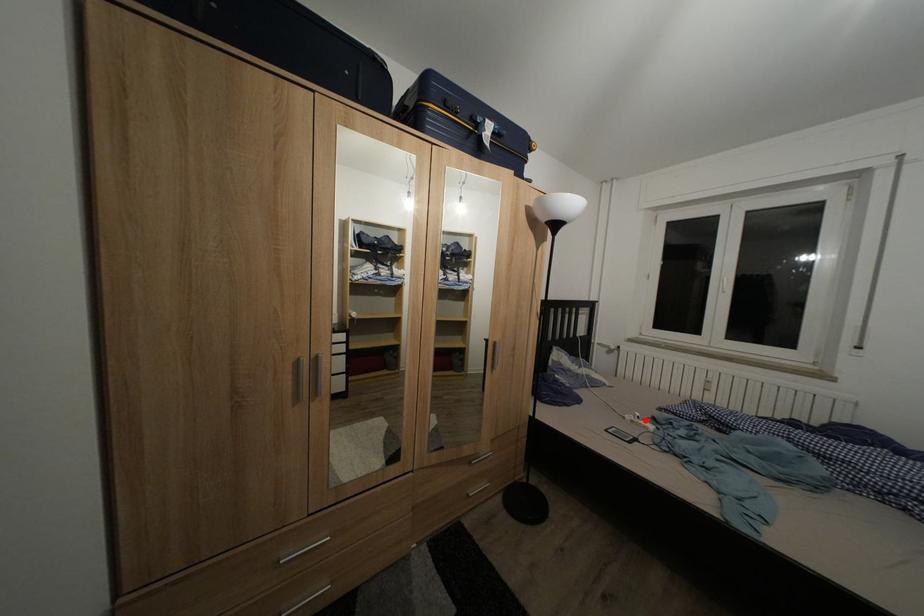
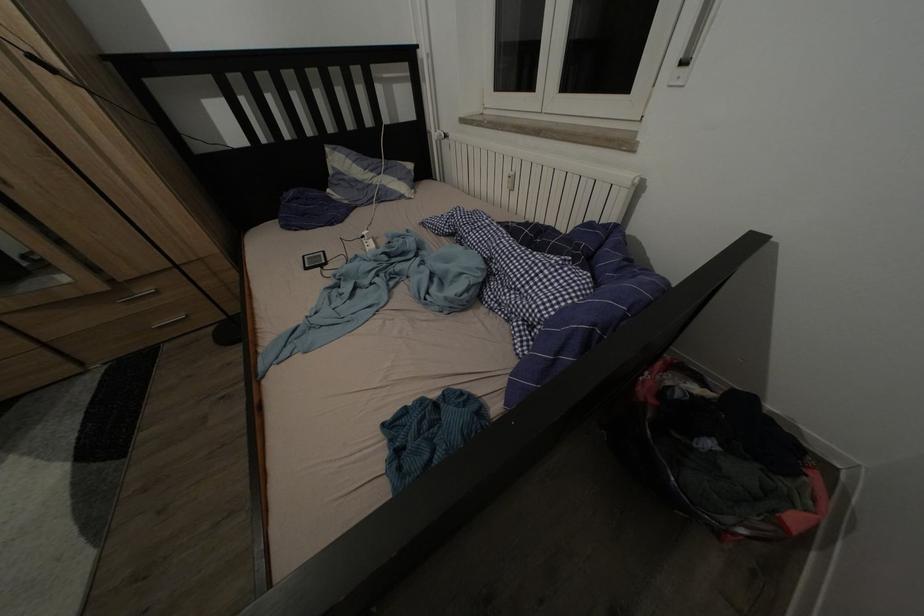
Where in the second image is the point corresponding to the highlighted location from the first image?

(372, 238)